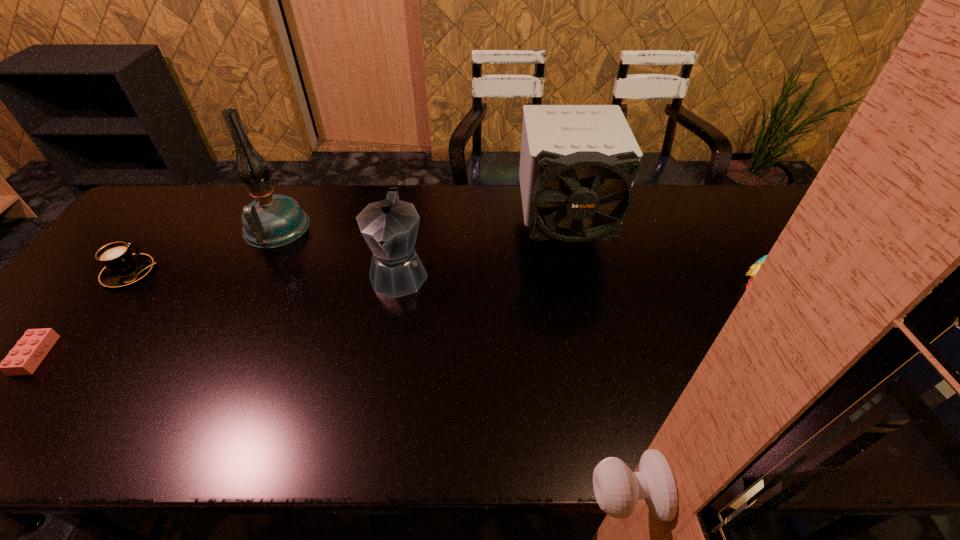
This screenshot has width=960, height=540. In order to click on the third object from left to right in this screenshot , I will do `click(272, 220)`.

Where is `fan`? The width and height of the screenshot is (960, 540). fan is located at coordinates (578, 163).

Locate an element on the screen. coffeepot is located at coordinates (390, 226).

Identify the location of cake. Image resolution: width=960 pixels, height=540 pixels. (754, 268).

Locate an element on the screen. The image size is (960, 540). the fifth tallest object is located at coordinates (122, 268).

Find the location of a particular element. This screenshot has width=960, height=540. the shortest object is located at coordinates (28, 353).

Where is `free space located on the front of the oil lamp`? The width and height of the screenshot is (960, 540). free space located on the front of the oil lamp is located at coordinates (235, 309).

You are a GUI agent. You are given a task and a screenshot of the screen. Output one action in this format:
    pyautogui.click(x=<x>, y=<y>)
    Task: Click on the vacant area located 0.320m on the right of the fan
    This screenshot has width=960, height=540.
    Given the screenshot: What is the action you would take?
    pyautogui.click(x=711, y=230)

At what (x,y) coordinates should I click in order to perform the action: click on vacant region located 0.280m at the spout of the coffeepot. Please return your answer as a coordinate pair (x, y). The width and height of the screenshot is (960, 540). Looking at the image, I should click on (376, 402).

Image resolution: width=960 pixels, height=540 pixels. In order to click on vacant region located on the left of the cake in this screenshot , I will do `click(605, 299)`.